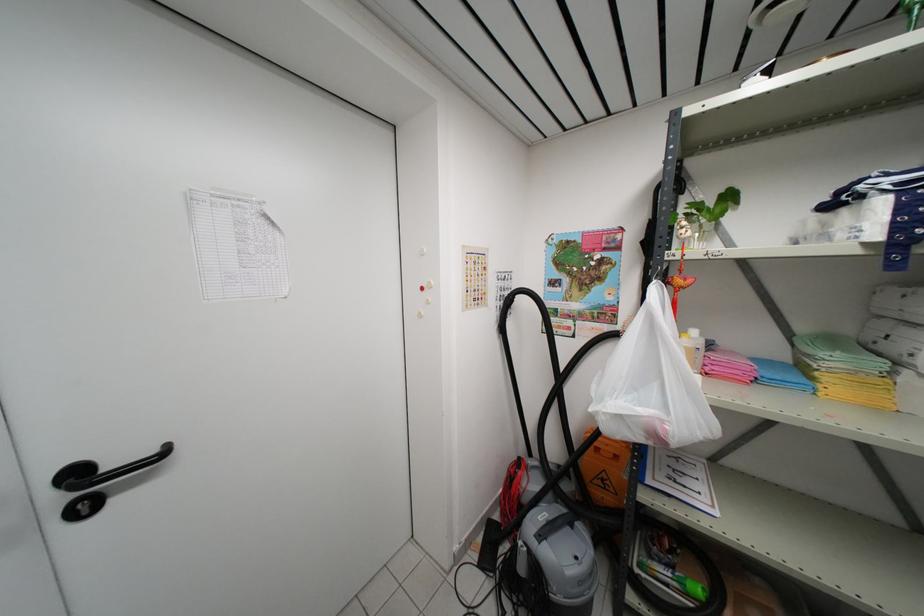
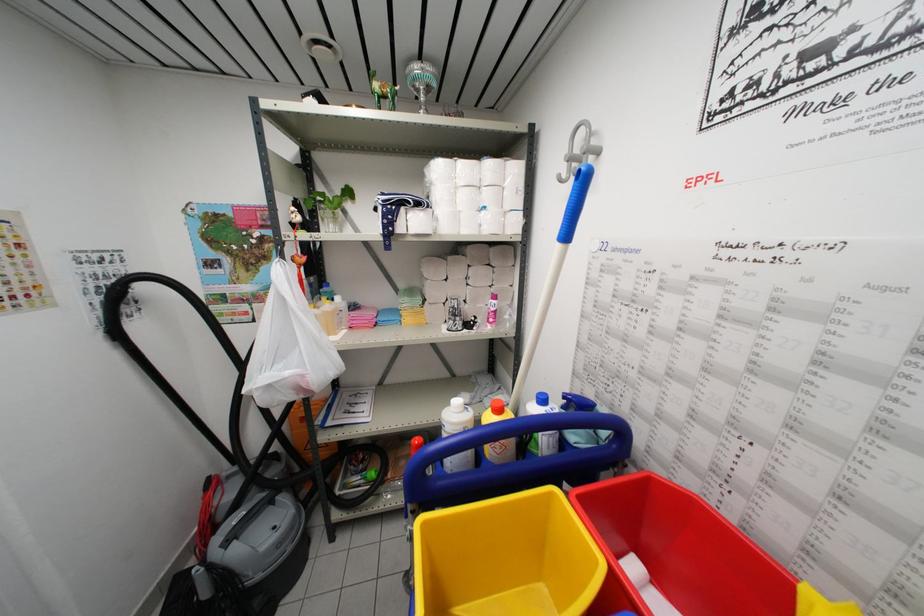
Question: The camera is either moving clockwise (left) or counter-clockwise (right) around the object. The first image is from the beginning of the video and the second image is from the end. Is the camera moving left or right when shooting the video?

Choices:
 (A) Left
 (B) Right

Answer: (A)